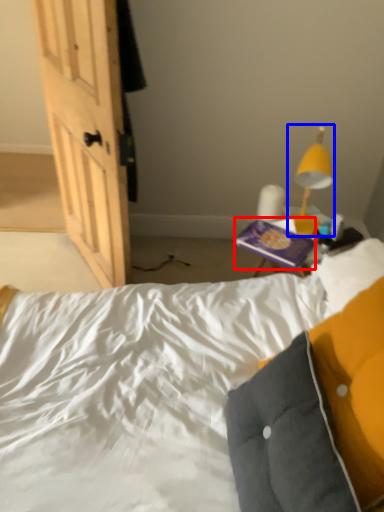
Question: Among these objects, which one is nearest to the camera, paperback book (highlighted by a red box) or lamp (highlighted by a blue box)?

Choices:
 (A) paperback book
 (B) lamp

Answer: (B)